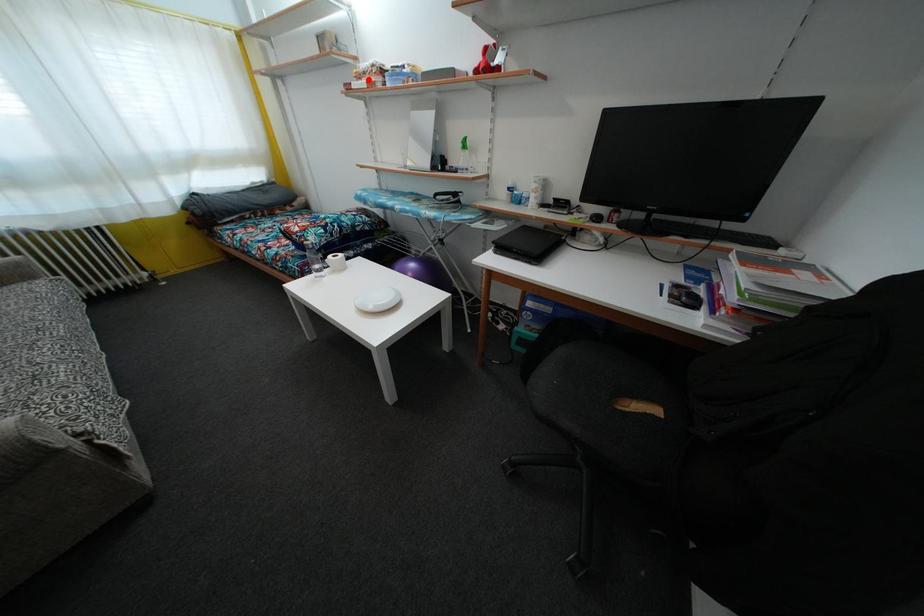
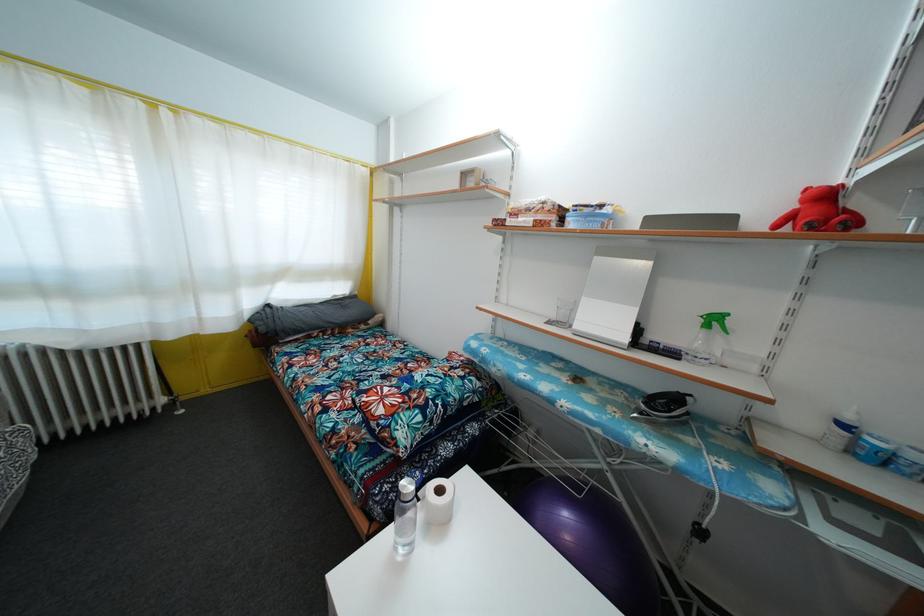
The point at the highlighted location is marked in the first image. Where is the corresponding point in the second image?

(531, 216)